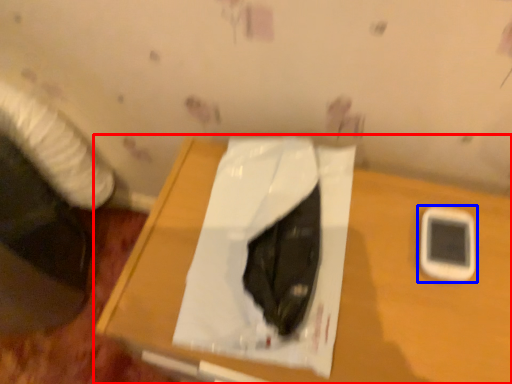
Question: Which of the following is the farthest to the observer, table (highlighted by a red box) or mobile phone (highlighted by a blue box)?

Choices:
 (A) table
 (B) mobile phone

Answer: (B)